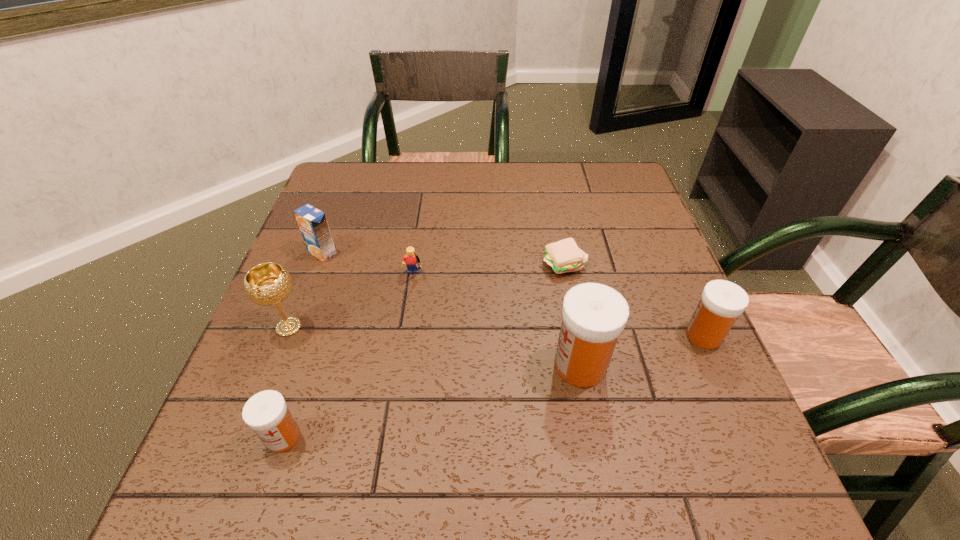
In order to click on vacant position for inserting another medicine evenly in this screenshot , I will do `click(441, 399)`.